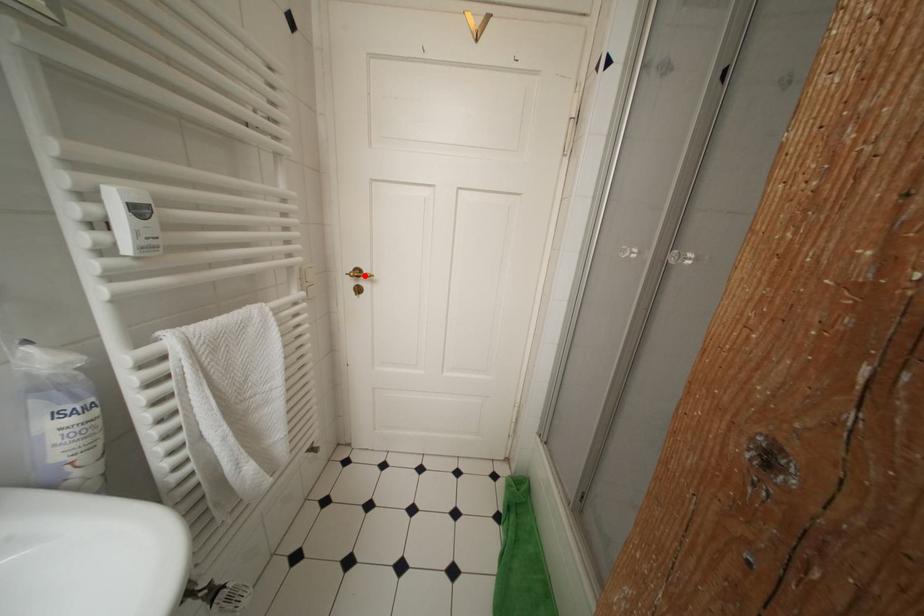
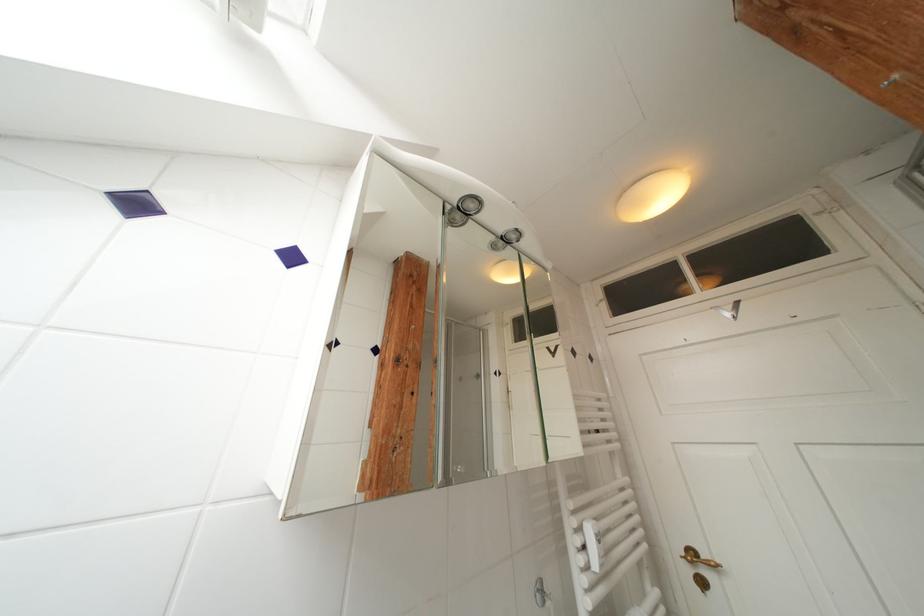
In the second image, find the point that corresponds to the highlighted location in the first image.

(699, 557)